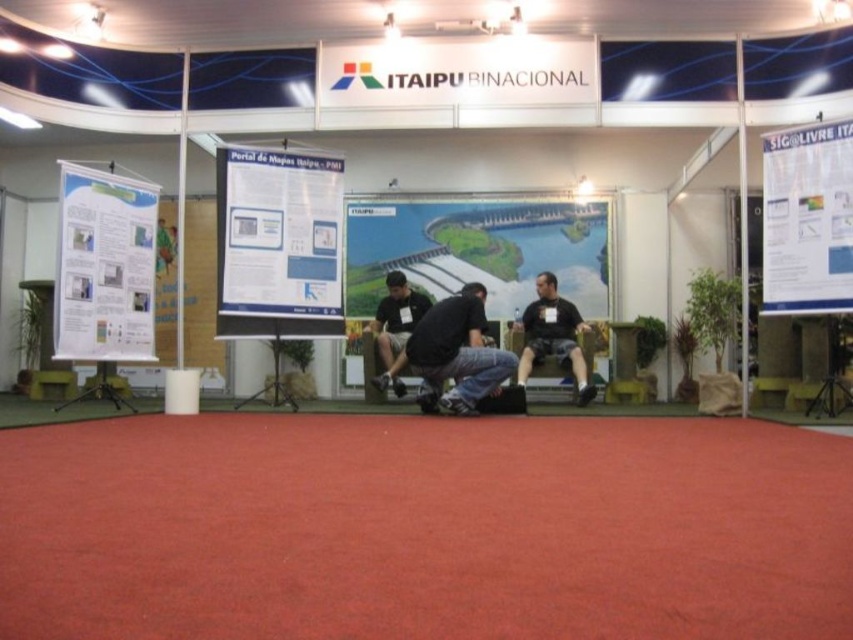
Question: Does black matte shirt at center appear under dark gray fabric shirt at center?

Choices:
 (A) yes
 (B) no

Answer: (A)

Question: From the image, what is the correct spatial relationship of white paper poster at left in relation to black matte shirt at center?

Choices:
 (A) below
 (B) above

Answer: (B)

Question: Which object is farther from the camera taking this photo?

Choices:
 (A) white paper at upper right
 (B) dark gray fabric shirt at center
 (C) black matte shirt at center

Answer: (C)

Question: Which of the following is the farthest from the observer?

Choices:
 (A) (97, 234)
 (B) (822, 128)

Answer: (A)

Question: Is white paper poster at left to the left of black matte shirt at center from the viewer's perspective?

Choices:
 (A) no
 (B) yes

Answer: (B)

Question: Which object appears closest to the camera in this image?

Choices:
 (A) white paper at upper right
 (B) white paper poster at center

Answer: (A)